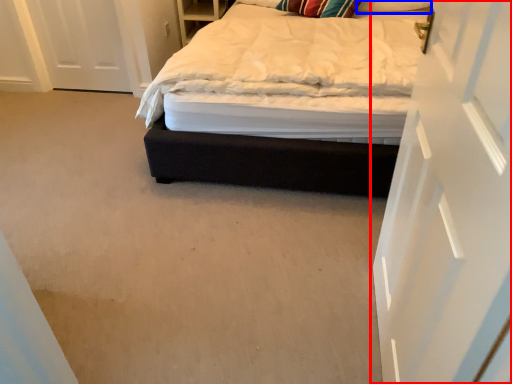
Question: Which object is further to the camera taking this photo, door (highlighted by a red box) or pillow (highlighted by a blue box)?

Choices:
 (A) door
 (B) pillow

Answer: (B)